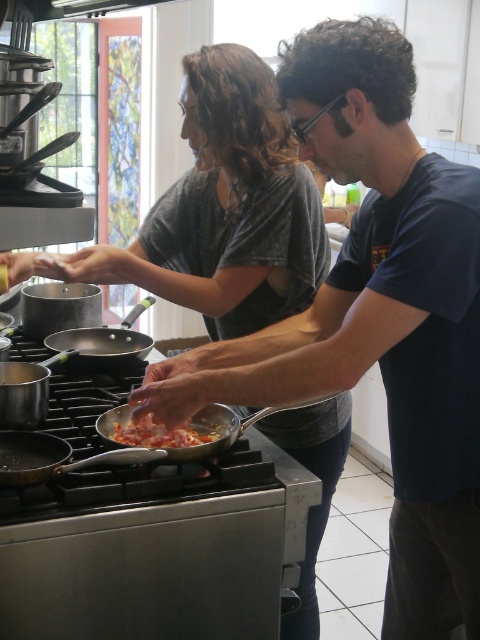
Question: Estimate the real-world distances between objects in this image. Which object is closer to the gold metallic frying pan at lower left?

Choices:
 (A) anodized aluminum wok at center
 (B) metallic silver wok at center
 (C) dark blue t-shirt at center
 (D) shiny metallic pan at center

Answer: (B)

Question: Is gold metallic frying pan at lower left positioned in front of anodized aluminum wok at center?

Choices:
 (A) yes
 (B) no

Answer: (A)

Question: Among these points, which one is farthest from the camera?

Choices:
 (A) (59, 456)
 (B) (141, 444)
 (C) (331, 323)

Answer: (B)

Question: Does gold metallic frying pan at lower left appear on the left side of shiny metallic pan at center?

Choices:
 (A) no
 (B) yes

Answer: (B)

Question: Which point is farther to the camera?

Choices:
 (A) dark blue t-shirt at center
 (B) anodized aluminum wok at center

Answer: (B)

Question: Observing the image, what is the correct spatial positioning of dark blue t-shirt at center in reference to anodized aluminum wok at center?

Choices:
 (A) right
 (B) left

Answer: (A)